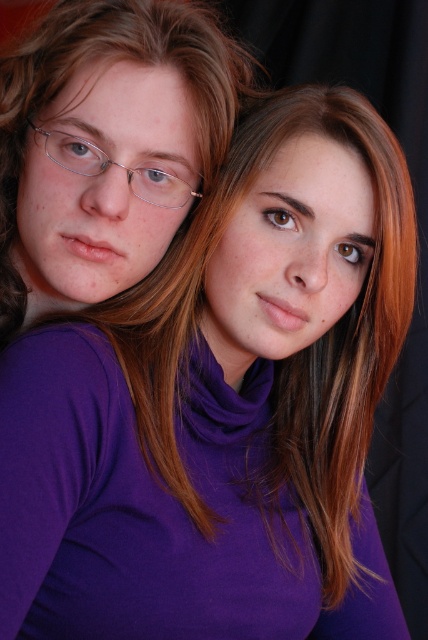
You are an interior designer analyzing the image. You notice a point at coordinates (113,61). What object is located at that point?

The point at coordinates (113,61) is occupied by the matte purple turtleneck at center.

You are a photographer trying to capture a closeup of the clear plastic glasses at upper left without the matte purple turtleneck at center blocking the view. Is it possible to frame the shot so that the glasses are fully visible without any part of the turtleneck appearing in the photo?

The matte purple turtleneck at center is bigger than clear plastic glasses at upper left. Since the turtleneck is larger, it might block the glasses depending on their positions. However, since the glasses are at upper left and the turtleneck is at center, you can adjust the camera angle to focus on the upper left area, ensuring only the glasses are in frame while excluding the turtleneck.

You are taking a photo of two people wearing the matte purple turtleneck at center and the clear plastic glasses at upper left. Which item will appear larger in the photo?

The matte purple turtleneck at center will appear larger in the photo because it is closer to the viewer than the clear plastic glasses at upper left.